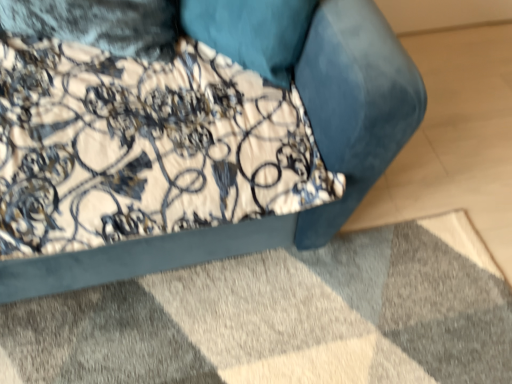
Question: Is velvet blue sofa at upper center positioned before velvet blue mat at lower center?

Choices:
 (A) no
 (B) yes

Answer: (B)

Question: Would you say velvet blue sofa at upper center is outside velvet blue mat at lower center?

Choices:
 (A) yes
 (B) no

Answer: (A)

Question: Considering the relative sizes of velvet blue sofa at upper center and velvet blue mat at lower center in the image provided, is velvet blue sofa at upper center shorter than velvet blue mat at lower center?

Choices:
 (A) no
 (B) yes

Answer: (A)

Question: From a real-world perspective, is velvet blue sofa at upper center on top of velvet blue mat at lower center?

Choices:
 (A) no
 (B) yes

Answer: (B)

Question: Is velvet blue sofa at upper center to the left of velvet blue mat at lower center from the viewer's perspective?

Choices:
 (A) yes
 (B) no

Answer: (A)

Question: Is velvet blue sofa at upper center behind velvet blue mat at lower center?

Choices:
 (A) no
 (B) yes

Answer: (A)

Question: Does velvet blue mat at lower center have a greater width compared to velvet blue sofa at upper center?

Choices:
 (A) no
 (B) yes

Answer: (B)

Question: From the image's perspective, is velvet blue mat at lower center above velvet blue sofa at upper center?

Choices:
 (A) no
 (B) yes

Answer: (A)

Question: Is velvet blue mat at lower center thinner than velvet blue sofa at upper center?

Choices:
 (A) no
 (B) yes

Answer: (A)

Question: Is velvet blue mat at lower center turned away from velvet blue sofa at upper center?

Choices:
 (A) no
 (B) yes

Answer: (A)

Question: Is the depth of velvet blue mat at lower center less than that of velvet blue sofa at upper center?

Choices:
 (A) no
 (B) yes

Answer: (A)

Question: Does velvet blue mat at lower center have a smaller size compared to velvet blue sofa at upper center?

Choices:
 (A) no
 (B) yes

Answer: (B)

Question: From the image's perspective, is velvet blue mat at lower center located above or below velvet blue sofa at upper center?

Choices:
 (A) below
 (B) above

Answer: (A)